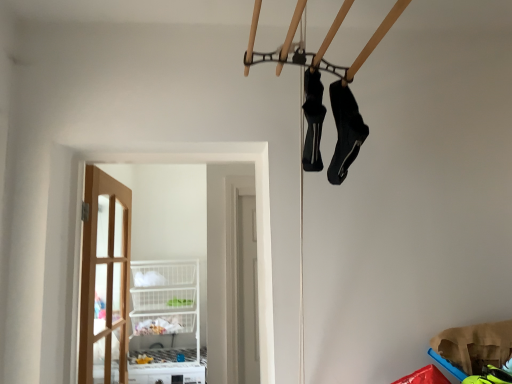
Question: Does black synthetic socks at upper right, which is the 1th footwear from right to left, lie in front of clear glass door at center?

Choices:
 (A) yes
 (B) no

Answer: (A)

Question: Is black synthetic socks at upper right, arranged as the second footwear when viewed from the left, beside clear glass door at center?

Choices:
 (A) no
 (B) yes

Answer: (A)

Question: Would you say black synthetic socks at upper right, which is the 1th footwear from right to left, contains clear glass door at center?

Choices:
 (A) yes
 (B) no

Answer: (B)

Question: Is black synthetic socks at upper right, which is the 1th footwear from right to left, oriented away from clear glass door at center?

Choices:
 (A) no
 (B) yes

Answer: (A)

Question: Is black synthetic socks at upper right, arranged as the second footwear when viewed from the left, smaller than clear glass door at center?

Choices:
 (A) yes
 (B) no

Answer: (A)

Question: Considering the positions of point (310, 130) and point (353, 155), is point (310, 130) closer or farther from the camera than point (353, 155)?

Choices:
 (A) closer
 (B) farther

Answer: (A)

Question: Is black matte shoe at center, placed as the 2th footwear when sorted from right to left, bigger or smaller than black synthetic socks at upper right, arranged as the second footwear when viewed from the left?

Choices:
 (A) big
 (B) small

Answer: (B)

Question: From a real-world perspective, is black matte shoe at center, acting as the 1th footwear starting from the left, above or below black synthetic socks at upper right, arranged as the second footwear when viewed from the left?

Choices:
 (A) below
 (B) above

Answer: (B)

Question: Looking at their shapes, would you say black matte shoe at center, acting as the 1th footwear starting from the left, is wider or thinner than black synthetic socks at upper right, arranged as the second footwear when viewed from the left?

Choices:
 (A) wide
 (B) thin

Answer: (B)

Question: Is point (262, 281) closer or farther from the camera than point (310, 109)?

Choices:
 (A) closer
 (B) farther

Answer: (B)

Question: Visually, is clear glass door at center positioned to the left or to the right of black matte shoe at center, placed as the 2th footwear when sorted from right to left?

Choices:
 (A) left
 (B) right

Answer: (A)

Question: From a real-world perspective, is clear glass door at center physically located above or below black matte shoe at center, acting as the 1th footwear starting from the left?

Choices:
 (A) above
 (B) below

Answer: (B)

Question: In the image, is clear glass door at center positioned in front of or behind black matte shoe at center, acting as the 1th footwear starting from the left?

Choices:
 (A) behind
 (B) front

Answer: (A)

Question: Would you say clear glass door at center is to the left or to the right of black synthetic socks at upper right, arranged as the second footwear when viewed from the left, in the picture?

Choices:
 (A) left
 (B) right

Answer: (A)

Question: Based on their sizes in the image, would you say clear glass door at center is bigger or smaller than black synthetic socks at upper right, arranged as the second footwear when viewed from the left?

Choices:
 (A) small
 (B) big

Answer: (B)